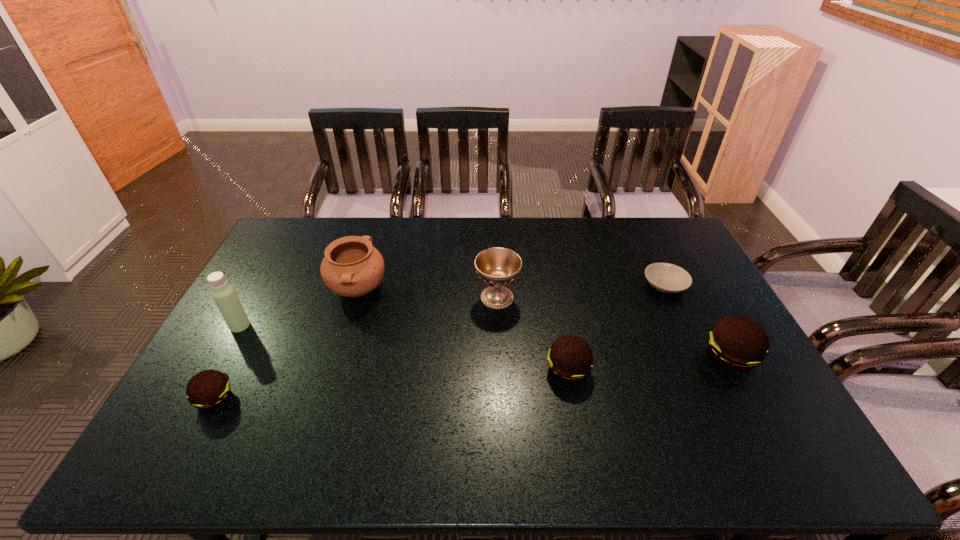
The image size is (960, 540). I want to click on the third closest object relative to the shortest patty, so click(498, 267).

The image size is (960, 540). Identify the location of patty that is the second closest to the fourth object from right to left. (736, 343).

This screenshot has width=960, height=540. What are the coordinates of `patty that is the third closest to the chalice` in the screenshot? It's located at (209, 389).

Where is `free location that satisfies the following two spatial constraints: 1. on the back side of the thermos bottle; 2. on the left side of the fifth object from right to left`? The width and height of the screenshot is (960, 540). free location that satisfies the following two spatial constraints: 1. on the back side of the thermos bottle; 2. on the left side of the fifth object from right to left is located at coordinates (259, 290).

Locate an element on the screen. This screenshot has width=960, height=540. free space in the image that satisfies the following two spatial constraints: 1. on the back side of the leftmost patty; 2. on the right side of the chalice is located at coordinates pyautogui.click(x=268, y=297).

This screenshot has height=540, width=960. Identify the location of free space that satisfies the following two spatial constraints: 1. on the front side of the fourth object from left to right; 2. on the right side of the fifth object from right to left. (355, 297).

Locate an element on the screen. vacant area in the image that satisfies the following two spatial constraints: 1. on the back side of the fourth tallest object; 2. on the left side of the fifth object from left to right is located at coordinates (565, 356).

Locate an element on the screen. The height and width of the screenshot is (540, 960). vacant region that satisfies the following two spatial constraints: 1. on the back side of the thermos bottle; 2. on the right side of the chalice is located at coordinates (255, 297).